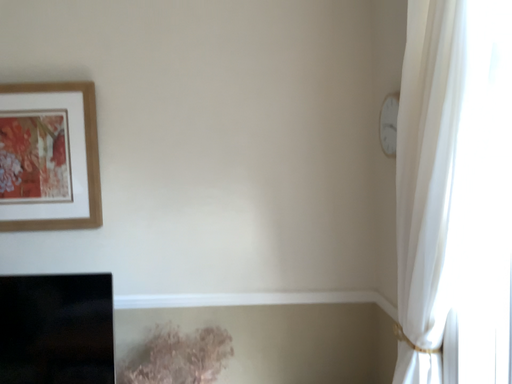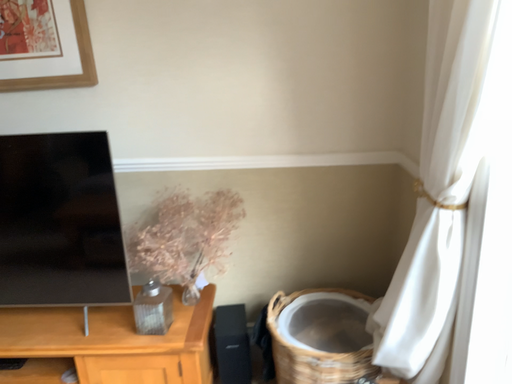
Question: Which way did the camera rotate in the video?

Choices:
 (A) rotated upward
 (B) rotated downward

Answer: (B)